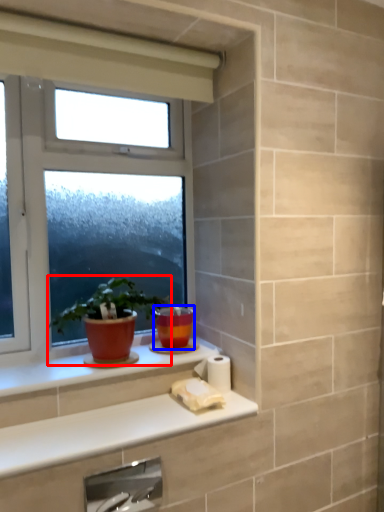
Question: Which object is further to the camera taking this photo, houseplant (highlighted by a red box) or flowerpot (highlighted by a blue box)?

Choices:
 (A) houseplant
 (B) flowerpot

Answer: (B)